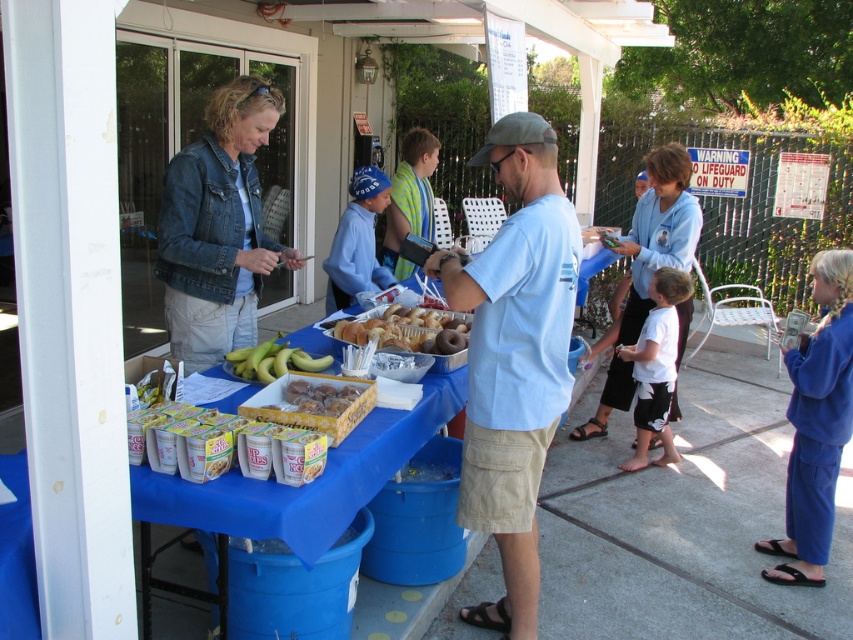
In the scene shown: You are a guest at a picnic and want to grab a snack. You see the yellow cardboard box of donuts at center and the yellow matte bananas at center on the table. Which item is taller?

The yellow cardboard box of donuts at center is much taller than the yellow matte bananas at center.

You are organizing a picnic and need to place the yellow cardboard box of donuts at center and the yellow matte bananas at center on a shelf. If the shelf can only hold items with a maximum width of 30 cm, which item might not fit based on their widths?

The yellow matte bananas at center might not fit on the shelf because the yellow cardboard box of donuts at center has a lesser width compared to yellow matte bananas at center, implying the bananas are wider than the 30 cm limit.

You are planning to place a rectangular gift box that is 12 inches wide on the table. The gift box needs to be placed between the yellow cardboard box of donuts at center and the golden brown glazed donuts at center. Given that the space between them is exactly the width of the narrower object, will the gift box fit?

The yellow cardboard box of donuts at center has a lesser width compared to the golden brown glazed donuts at center. Since the space between them is exactly the width of the narrower object, which is the yellow cardboard box of donuts at center, the gift box requiring 12 inches may not fit if the narrower object is less than 12 inches wide. However, without specific measurements of the narrower object, we cannot definitively confirm the fit.